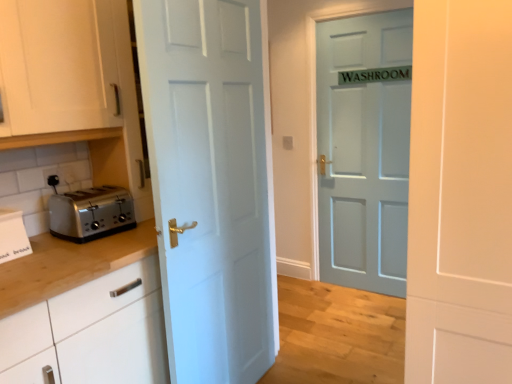
Question: Is white matte door at center, the first door in the front-to-back sequence, in front of or behind satin silver toaster at left in the image?

Choices:
 (A) front
 (B) behind

Answer: (A)

Question: Is white matte door at center, the first door in the front-to-back sequence, bigger or smaller than satin silver toaster at left?

Choices:
 (A) small
 (B) big

Answer: (B)

Question: Based on their relative distances, which object is farther from the satin silver toaster at left?

Choices:
 (A) white cardboard box at left
 (B) white matte door at center, the 3th door in the back-to-front sequence
 (C) light blue matte door at center, the 1th door positioned from the back
 (D) white glossy door at center, which is the second door from front to back
 (E) white matte cabinet at upper left

Answer: (C)

Question: Based on their relative distances, which object is nearer to the satin silver toaster at left?

Choices:
 (A) white glossy door at center, which is the second door from front to back
 (B) white cardboard box at left
 (C) white matte cabinet at upper left
 (D) white matte door at center, the first door in the front-to-back sequence
 (E) light blue matte door at center, the 1th door positioned from the back

Answer: (B)